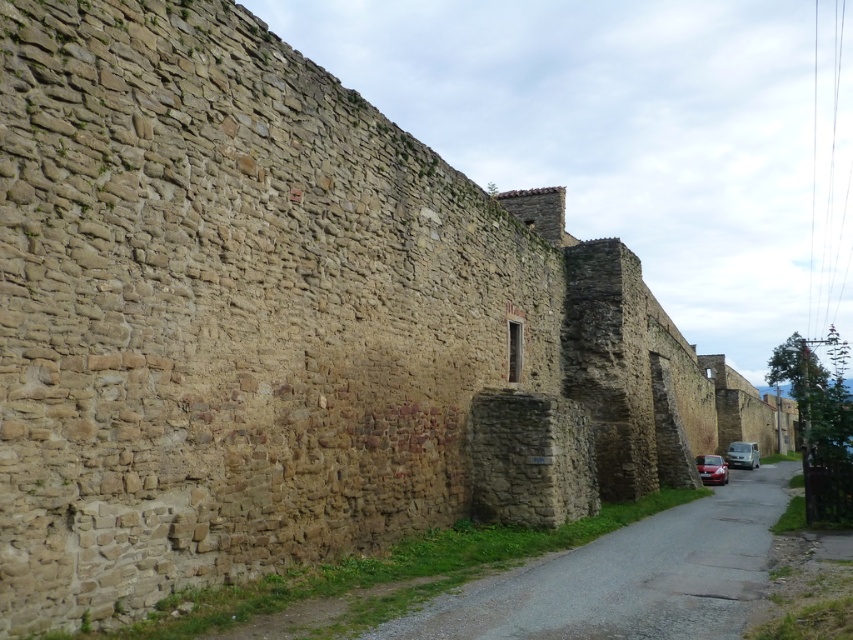
Does smooth stone wall at center have a smaller size compared to shiny red car at lower right?

Actually, smooth stone wall at center might be larger than shiny red car at lower right.

Between point (746, 616) and point (721, 470), which one is positioned in front?

Positioned in front is point (746, 616).

Locate an element on the screen. Image resolution: width=853 pixels, height=640 pixels. smooth stone wall at center is located at coordinates (627, 577).

In order to click on smooth stone wall at center in this screenshot , I will do `click(627, 577)`.

Does smooth stone wall at center appear under silver metallic van at center-right?

Actually, smooth stone wall at center is above silver metallic van at center-right.

This screenshot has height=640, width=853. Find the location of `smooth stone wall at center`. smooth stone wall at center is located at coordinates (627, 577).

Is shiny red car at lower right bigger than silver metallic van at center-right?

No, shiny red car at lower right is not bigger than silver metallic van at center-right.

Can you confirm if shiny red car at lower right is thinner than silver metallic van at center-right?

Yes.

Is point (712, 472) more distant than point (729, 456)?

No, it is not.

Locate an element on the screen. shiny red car at lower right is located at coordinates (711, 468).